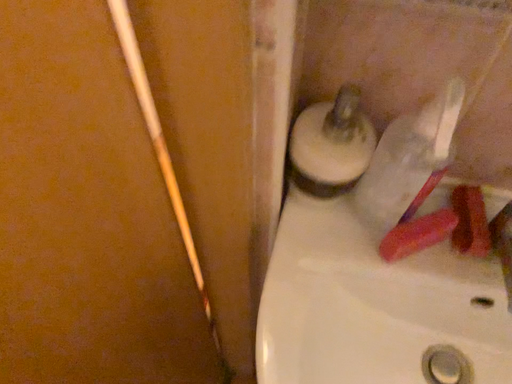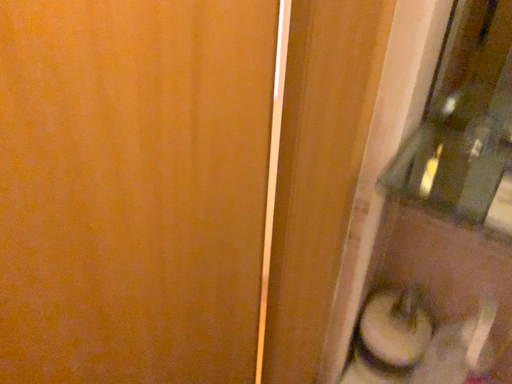
Question: How did the camera likely rotate when shooting the video?

Choices:
 (A) rotated right
 (B) rotated left

Answer: (B)